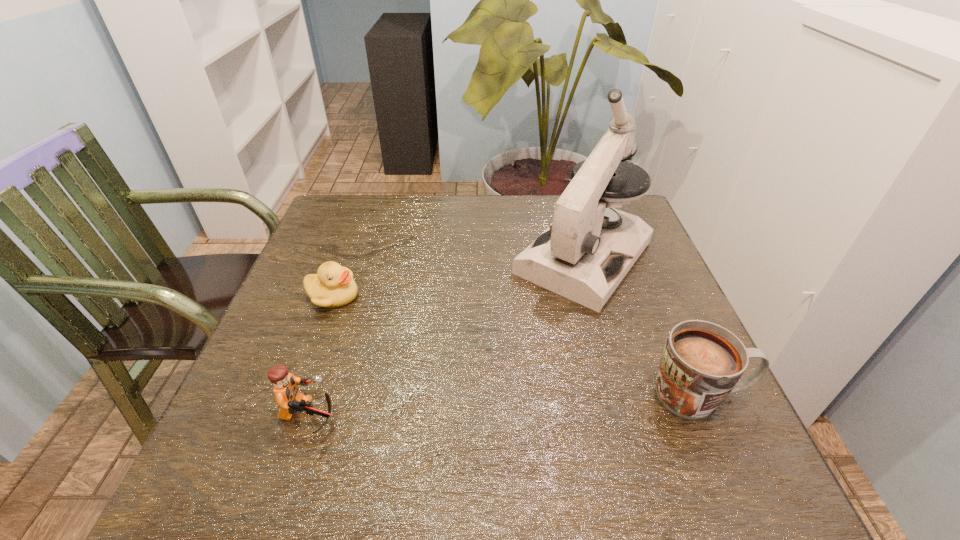
The height and width of the screenshot is (540, 960). In order to click on unoccupied position between the duckling and the mug in this screenshot , I will do `click(516, 345)`.

The image size is (960, 540). I want to click on free area in between the Lego and the duckling, so click(321, 356).

Locate an element on the screen. The height and width of the screenshot is (540, 960). free spot between the microscope and the Lego is located at coordinates (446, 337).

Locate an element on the screen. This screenshot has width=960, height=540. free spot between the mug and the tallest object is located at coordinates (641, 326).

Locate an element on the screen. This screenshot has width=960, height=540. free space between the mug and the duckling is located at coordinates (516, 345).

You are a GUI agent. You are given a task and a screenshot of the screen. Output one action in this format:
    pyautogui.click(x=<x>, y=<y>)
    Task: Click on the free spot between the Lego and the mug
    This screenshot has width=960, height=540.
    Given the screenshot: What is the action you would take?
    pyautogui.click(x=504, y=406)

Choose which object is the second nearest neighbor to the mug. Please provide its 2D coordinates. Your answer should be formatted as a tuple, i.e. [(x, y)], where the tuple contains the x and y coordinates of a point satisfying the conditions above.

[(290, 400)]

Locate an element on the screen. The image size is (960, 540). the second closest object to the tallest object is located at coordinates (333, 286).

Locate an element on the screen. vacant area that satisfies the following two spatial constraints: 1. on the front side of the microscope; 2. on the side of the mug with the handle is located at coordinates (623, 395).

Find the location of a particular element. This screenshot has height=540, width=960. vacant area that satisfies the following two spatial constraints: 1. on the front side of the shortest object; 2. on the side of the mug with the handle is located at coordinates (297, 395).